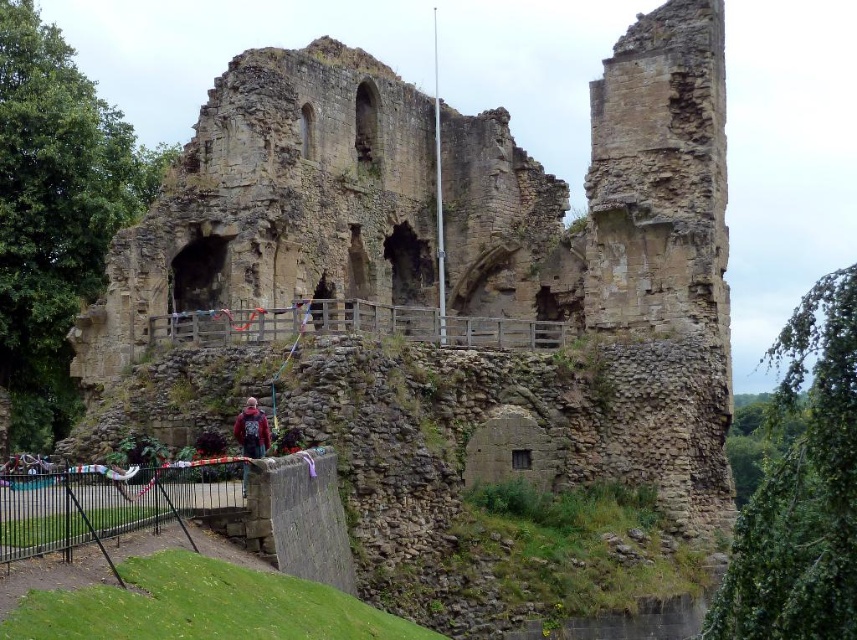
Question: Is brown stone ruins at center positioned in front of dark red sweater at center?

Choices:
 (A) no
 (B) yes

Answer: (A)

Question: Does brown stone ruins at center appear on the right side of dark red sweater at center?

Choices:
 (A) yes
 (B) no

Answer: (A)

Question: Which point is closer to the camera taking this photo?

Choices:
 (A) (339, 161)
 (B) (249, 429)

Answer: (B)

Question: Which point is closer to the camera?

Choices:
 (A) click(256, 403)
 (B) click(226, 113)

Answer: (A)

Question: Can you confirm if brown stone ruins at center is thinner than dark red sweater at center?

Choices:
 (A) yes
 (B) no

Answer: (B)